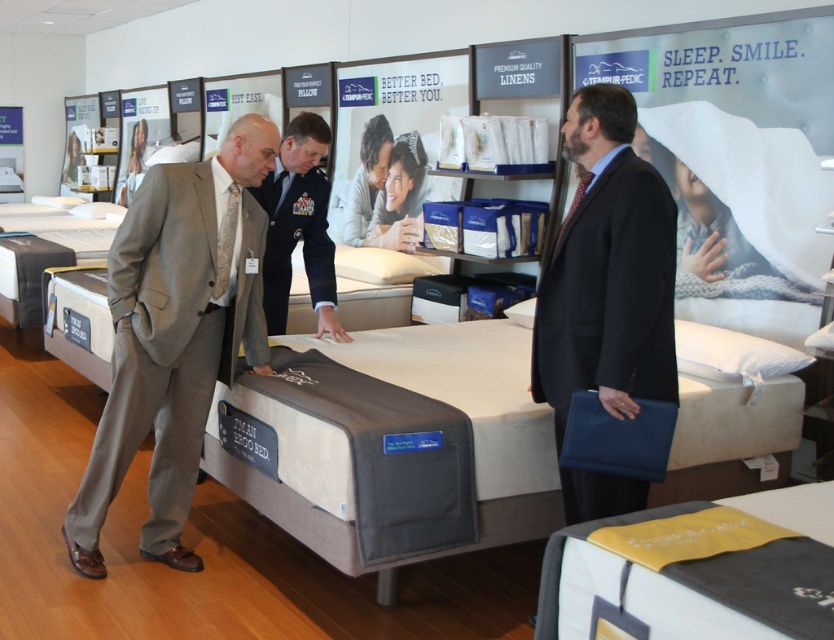
Question: Which of the following is the closest to the observer?

Choices:
 (A) (162, 422)
 (B) (29, 264)
 (C) (327, 342)

Answer: (A)

Question: Which object appears closest to the camera in this image?

Choices:
 (A) dark gray suit at center
 (B) beige fabric mattress at center
 (C) gray wool suit at left
 (D) dark blue uniform at center

Answer: (A)

Question: Which object is positioned farthest from the beige fabric mattress at center?

Choices:
 (A) gray fabric mattress at center
 (B) gray wool suit at left
 (C) dark gray suit at center

Answer: (A)

Question: Can you confirm if dark blue uniform at center is bigger than gray fabric mattress at center?

Choices:
 (A) no
 (B) yes

Answer: (A)

Question: Is beige fabric mattress at center below gray wool suit at left?

Choices:
 (A) no
 (B) yes

Answer: (B)

Question: Can you confirm if gray wool suit at left is smaller than dark gray suit at center?

Choices:
 (A) no
 (B) yes

Answer: (A)